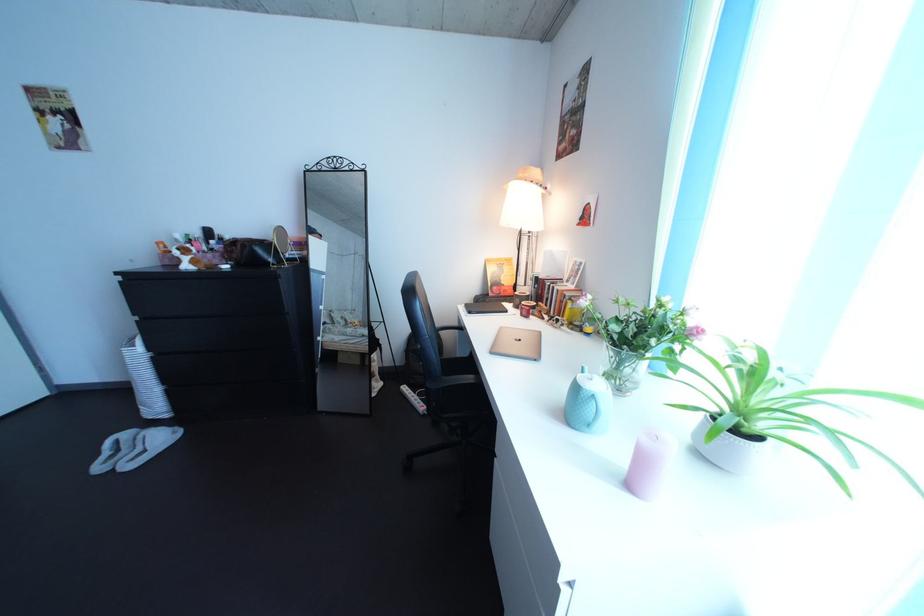
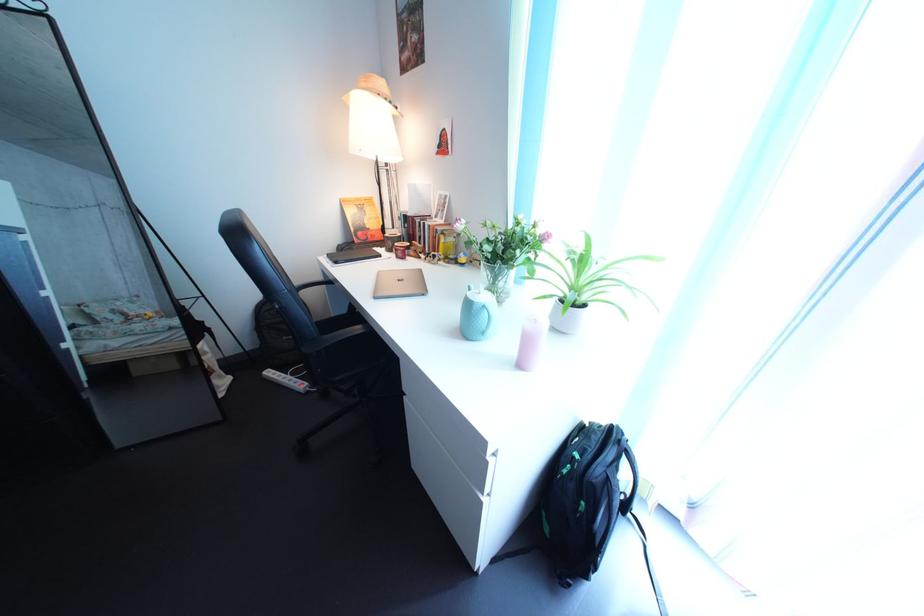
The point at (638,471) is marked in the first image. Where is the corresponding point in the second image?

(527, 360)